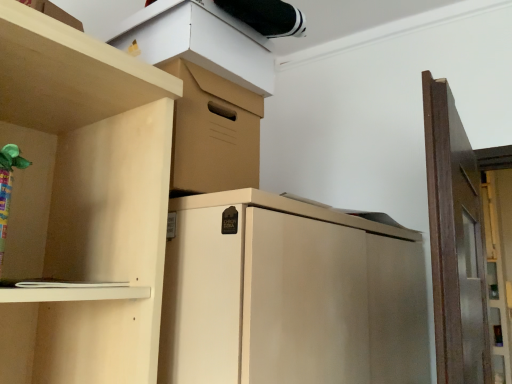
The height and width of the screenshot is (384, 512). What do you see at coordinates (455, 242) in the screenshot?
I see `brown wooden door at right` at bounding box center [455, 242].

Where is `brown wooden door at right`? This screenshot has width=512, height=384. brown wooden door at right is located at coordinates (455, 242).

The height and width of the screenshot is (384, 512). Identify the location of matte cardboard box at upper center. (199, 41).

Describe the element at coordinates (199, 41) in the screenshot. The height and width of the screenshot is (384, 512). I see `matte cardboard box at upper center` at that location.

The image size is (512, 384). Find the location of `brown wooden door at right`. brown wooden door at right is located at coordinates (x=455, y=242).

Considering the relative positions of matte cardboard box at upper center and brown wooden door at right in the image provided, is matte cardboard box at upper center to the left of brown wooden door at right from the viewer's perspective?

Yes, matte cardboard box at upper center is to the left of brown wooden door at right.

Considering their positions, is matte cardboard box at upper center located in front of or behind brown wooden door at right?

Visually, matte cardboard box at upper center is located behind brown wooden door at right.

Is point (186, 33) closer to camera compared to point (442, 261)?

No, it is behind (442, 261).

From the image's perspective, is matte cardboard box at upper center beneath brown wooden door at right?

Actually, matte cardboard box at upper center appears above brown wooden door at right in the image.

From a real-world perspective, which object stands above the other?

matte cardboard box at upper center, from a real-world perspective.

Can you confirm if matte cardboard box at upper center is thinner than brown wooden door at right?

Yes, matte cardboard box at upper center is thinner than brown wooden door at right.

Which of these two, matte cardboard box at upper center or brown wooden door at right, stands taller?

brown wooden door at right.

Which of these two, matte cardboard box at upper center or brown wooden door at right, is bigger?

With larger size is brown wooden door at right.

Is brown wooden door at right inside matte cardboard box at upper center?

No, matte cardboard box at upper center does not contain brown wooden door at right.

Are matte cardboard box at upper center and brown wooden door at right making contact?

matte cardboard box at upper center and brown wooden door at right are not in contact.

In the scene shown: Is matte cardboard box at upper center facing away from brown wooden door at right?

No, brown wooden door at right is not at the back of matte cardboard box at upper center.

Find the location of a particular element. cabinet to the left of brown wooden door at right is located at coordinates (199, 41).

Based on their positions, is brown wooden door at right located to the left or right of matte cardboard box at upper center?

From the image, it's evident that brown wooden door at right is to the right of matte cardboard box at upper center.

Looking at this image, does brown wooden door at right lie behind matte cardboard box at upper center?

That is False.

Which is behind, point (468, 331) or point (182, 40)?

Positioned behind is point (468, 331).

From the image's perspective, which one is positioned lower, brown wooden door at right or matte cardboard box at upper center?

brown wooden door at right is shown below in the image.

From a real-world perspective, is brown wooden door at right below matte cardboard box at upper center?

Yes, from a real-world perspective, brown wooden door at right is beneath matte cardboard box at upper center.

Considering the relative sizes of brown wooden door at right and matte cardboard box at upper center in the image provided, is brown wooden door at right thinner than matte cardboard box at upper center?

In fact, brown wooden door at right might be wider than matte cardboard box at upper center.

Based on the photo, from their relative heights in the image, would you say brown wooden door at right is taller or shorter than matte cardboard box at upper center?

In the image, brown wooden door at right appears to be taller than matte cardboard box at upper center.

Considering the sizes of brown wooden door at right and matte cardboard box at upper center in the image, is brown wooden door at right bigger or smaller than matte cardboard box at upper center?

In the image, brown wooden door at right appears to be larger than matte cardboard box at upper center.

Choose the correct answer: Is brown wooden door at right inside matte cardboard box at upper center or outside it?

brown wooden door at right lies outside matte cardboard box at upper center.

Is brown wooden door at right placed right next to matte cardboard box at upper center?

They are not placed beside each other.

Is brown wooden door at right positioned with its back to matte cardboard box at upper center?

brown wooden door at right does not have its back to matte cardboard box at upper center.

How many degrees apart are the facing directions of brown wooden door at right and matte cardboard box at upper center?

The angle between the facing direction of brown wooden door at right and the facing direction of matte cardboard box at upper center is 82.1 degrees.

Identify the location of cabinet above the brown wooden door at right (from the image's perspective). This screenshot has width=512, height=384. point(199,41).

The image size is (512, 384). What are the coordinates of `door that is under the matte cardboard box at upper center (from a real-world perspective)` in the screenshot? It's located at (455, 242).

Where is `door on the right of matte cardboard box at upper center`? door on the right of matte cardboard box at upper center is located at coordinates (455, 242).